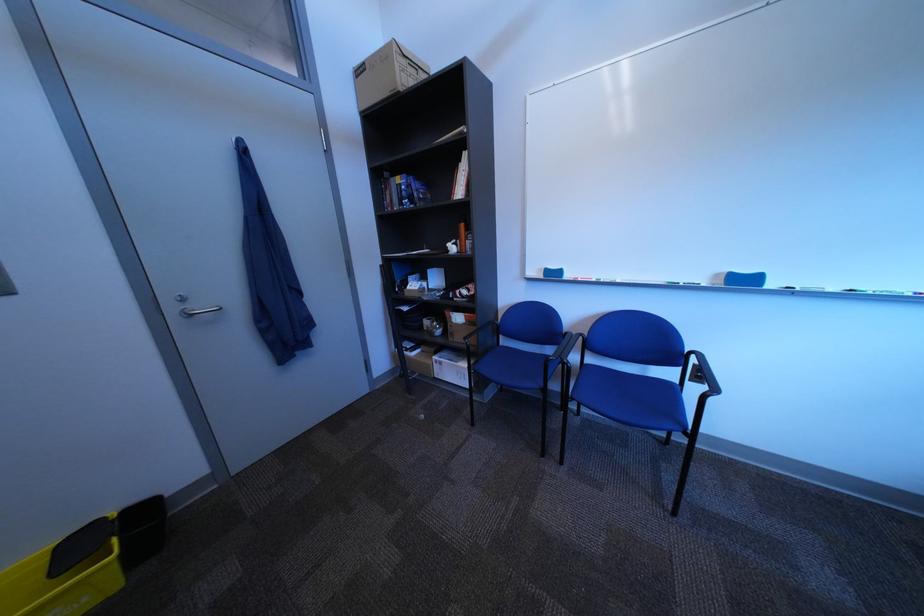
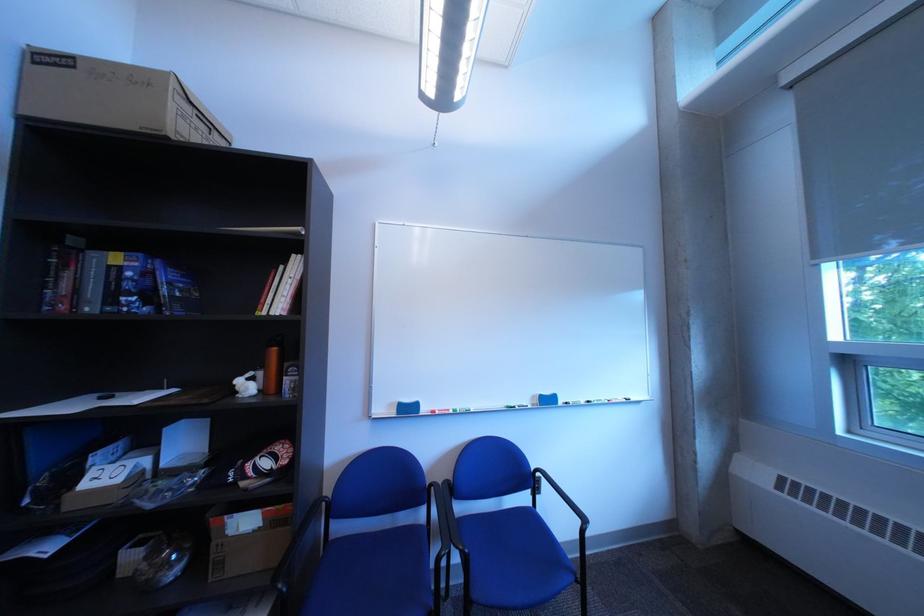
The point at (468, 336) is marked in the first image. Where is the corresponding point in the second image?

(237, 565)